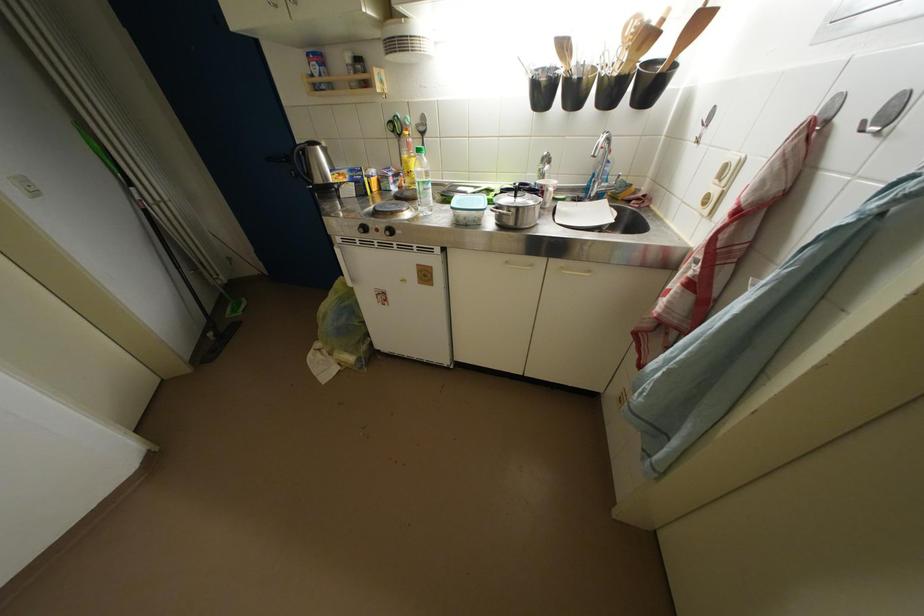
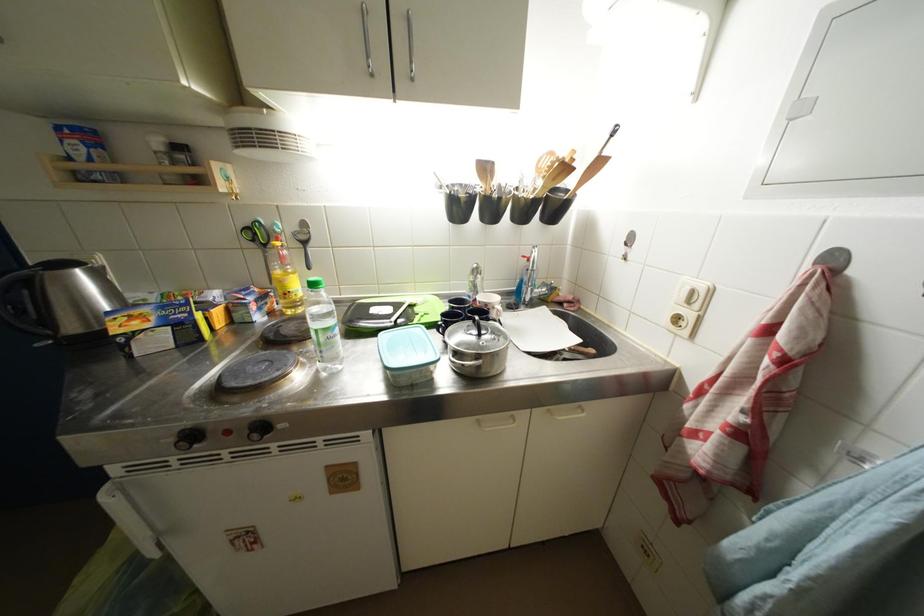
In the second image, find the point that corresponds to (397,121) in the first image.

(253, 227)